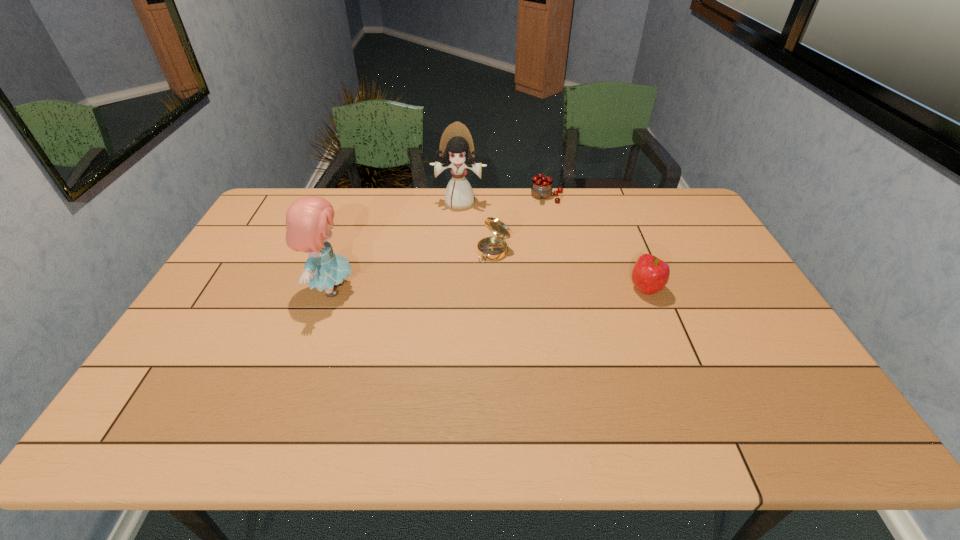
This screenshot has height=540, width=960. Find the location of `free space that is in between the apple and the right doll`. free space that is in between the apple and the right doll is located at coordinates (553, 246).

Identify the location of free point between the apple and the compass. The height and width of the screenshot is (540, 960). (570, 270).

At what (x,y) coordinates should I click in order to perform the action: click on free point between the compass and the pot filled with cherries. Please return your answer as a coordinate pair (x, y). Image resolution: width=960 pixels, height=540 pixels. Looking at the image, I should click on (520, 224).

Find the location of a particular element. The height and width of the screenshot is (540, 960). vacant area between the compass and the right doll is located at coordinates (477, 227).

In order to click on object that can be found as the third closest to the pot filled with cherries in this screenshot , I will do `click(650, 275)`.

Find the location of a particular element. The width and height of the screenshot is (960, 540). the closest object relative to the apple is located at coordinates (490, 248).

The height and width of the screenshot is (540, 960). What are the coordinates of `free point that satisfies the following two spatial constraints: 1. on the front side of the apple; 2. on the right side of the compass` in the screenshot? It's located at (495, 289).

You are a GUI agent. You are given a task and a screenshot of the screen. Output one action in this format:
    pyautogui.click(x=<x>, y=<y>)
    Task: Click on the vacant space that satisfies the following two spatial constraints: 1. on the front side of the pot filled with cherries; 2. on the left side of the apple
    
    Given the screenshot: What is the action you would take?
    pyautogui.click(x=565, y=289)

Image resolution: width=960 pixels, height=540 pixels. What are the coordinates of `free location that satisfies the following two spatial constraints: 1. on the front side of the compass; 2. on the right side of the apple` in the screenshot? It's located at (495, 289).

I want to click on vacant point that satisfies the following two spatial constraints: 1. on the front side of the right doll; 2. on the right side of the compass, so click(x=457, y=252).